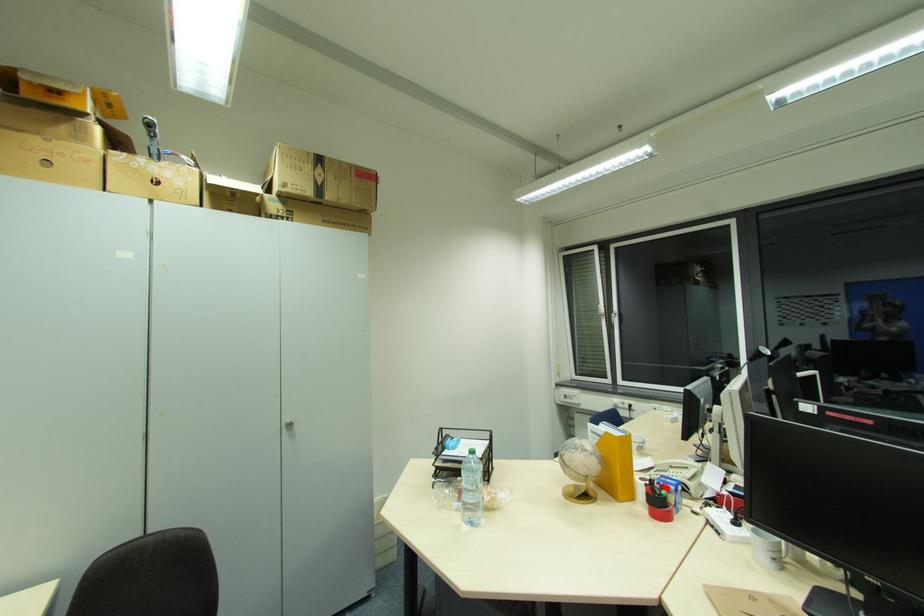
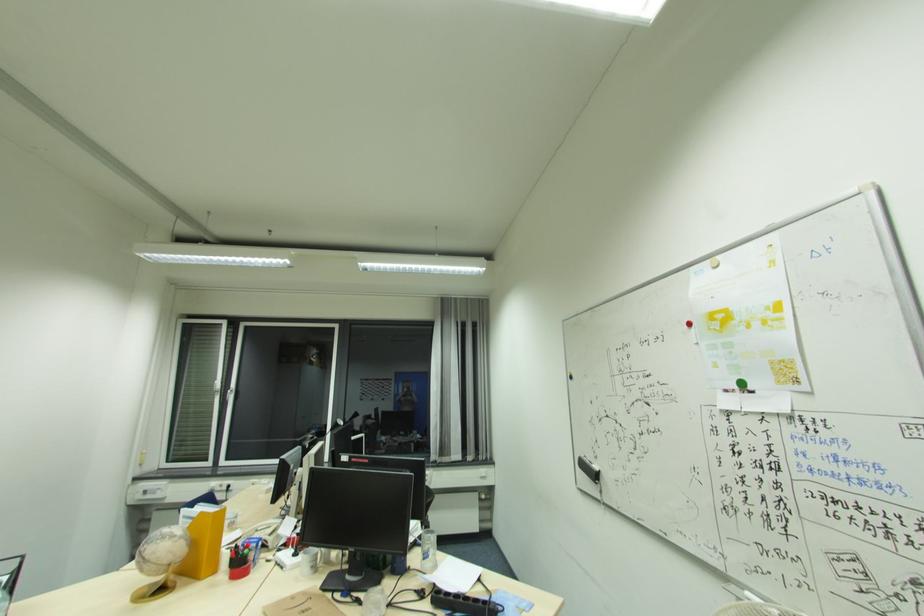
The point at the highlighted location is marked in the first image. Where is the corresponding point in the second image?

(250, 548)